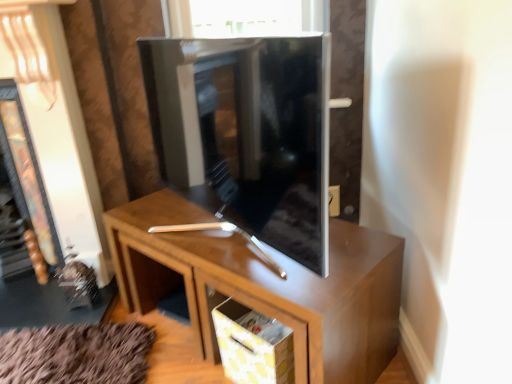
This screenshot has height=384, width=512. What are the coordinates of `vacant space situated above brown wood cabinet at center (from a real-world perspective)` in the screenshot? It's located at (230, 238).